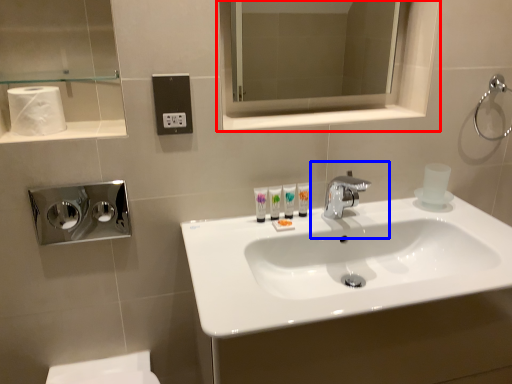
Question: Which object is closer to the camera taking this photo, medicine cabinet (highlighted by a red box) or plumbing fixture (highlighted by a blue box)?

Choices:
 (A) medicine cabinet
 (B) plumbing fixture

Answer: (B)